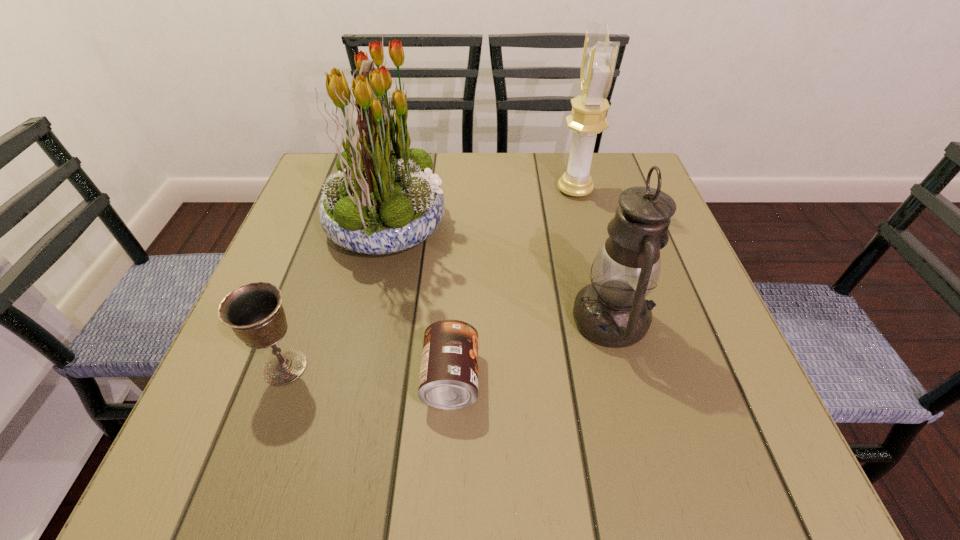
Locate an element on the screen. The width and height of the screenshot is (960, 540). vacant space situated 0.130m on the right of the second shortest object is located at coordinates (390, 367).

This screenshot has height=540, width=960. Identify the location of vacant space situated 0.150m on the front label of the can. (571, 379).

This screenshot has width=960, height=540. What are the coordinates of `flower arrangement that is at the far edge` in the screenshot? It's located at (384, 199).

Locate an element on the screen. This screenshot has width=960, height=540. award located in the far edge section of the desktop is located at coordinates (588, 117).

The width and height of the screenshot is (960, 540). Find the location of `flower arrangement present at the left edge`. flower arrangement present at the left edge is located at coordinates (384, 199).

Locate an element on the screen. This screenshot has height=540, width=960. chalice located in the left edge section of the desktop is located at coordinates (254, 312).

Locate an element on the screen. Image resolution: width=960 pixels, height=540 pixels. award that is at the right edge is located at coordinates (588, 117).

The width and height of the screenshot is (960, 540). I want to click on oil lamp that is at the right edge, so click(x=612, y=311).

Find the location of `object that is at the far left corner`. object that is at the far left corner is located at coordinates (384, 199).

Where is `object situated at the far right corner`? The height and width of the screenshot is (540, 960). object situated at the far right corner is located at coordinates (588, 117).